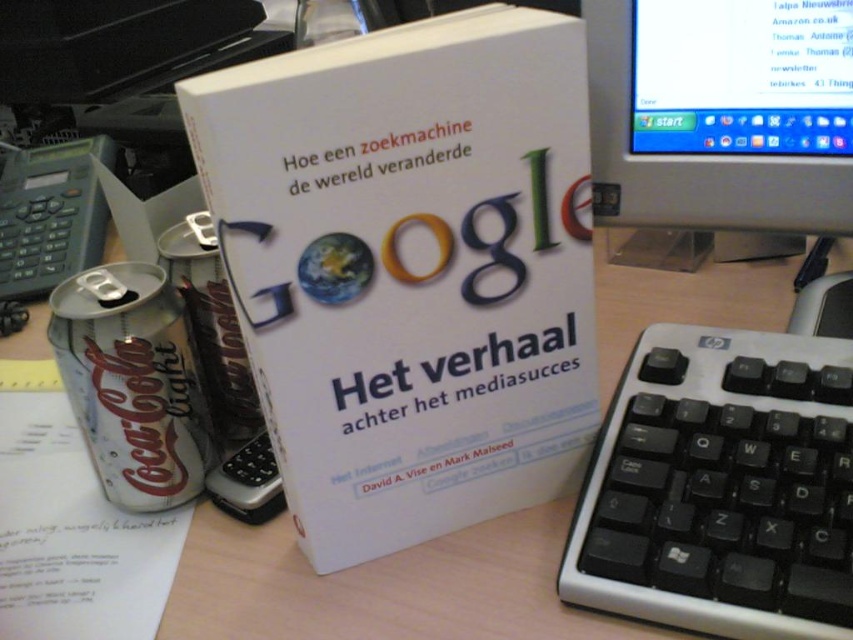
Does white plastic keyboard at right have a lesser width compared to silver metallic can at lower left?

No, white plastic keyboard at right is not thinner than silver metallic can at lower left.

Describe the element at coordinates (721, 486) in the screenshot. I see `white plastic keyboard at right` at that location.

At what (x,y) coordinates should I click in order to perform the action: click on white plastic keyboard at right. Please return your answer as a coordinate pair (x, y). Looking at the image, I should click on (721, 486).

Is white paper book at center to the left of matte plastic monitor at upper right from the viewer's perspective?

Indeed, white paper book at center is positioned on the left side of matte plastic monitor at upper right.

Who is positioned more to the right, white paper book at center or matte plastic monitor at upper right?

matte plastic monitor at upper right is more to the right.

Where is `white paper book at center`? Image resolution: width=853 pixels, height=640 pixels. white paper book at center is located at coordinates (409, 269).

Is white plastic computer desk at center to the right of matte plastic monitor at upper right from the viewer's perspective?

Incorrect, white plastic computer desk at center is not on the right side of matte plastic monitor at upper right.

Does white plastic computer desk at center have a smaller size compared to matte plastic monitor at upper right?

No.

Is point (527, 627) more distant than point (683, 205)?

No, (527, 627) is in front of (683, 205).

What are the coordinates of `white plastic computer desk at center` in the screenshot? It's located at (383, 586).